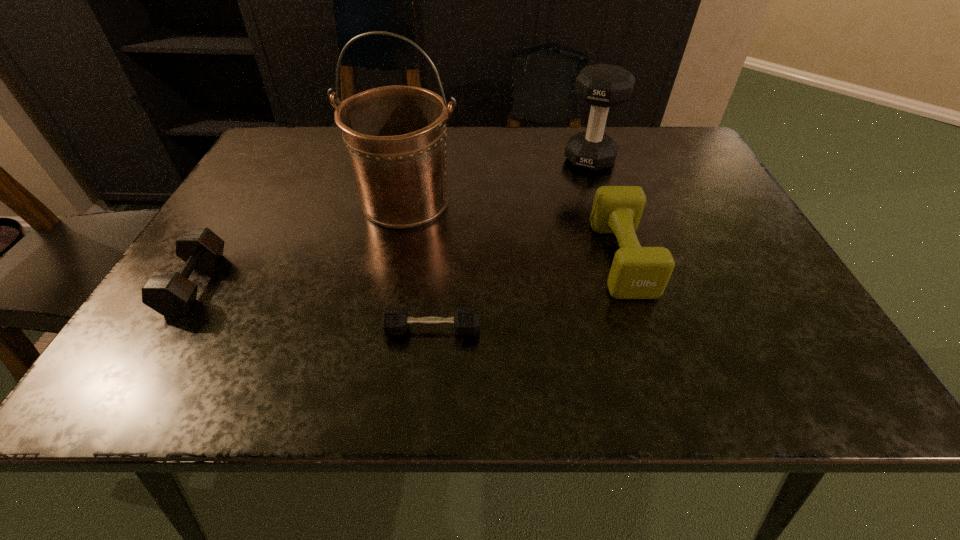
What are the coordinates of `free space located 0.210m on the back of the third tallest object` in the screenshot? It's located at pos(593,170).

The width and height of the screenshot is (960, 540). Identify the location of free space located 0.130m on the back of the leftmost dumbbell. (237, 215).

I want to click on vacant point located 0.260m on the left of the shortest object, so click(x=235, y=329).

The image size is (960, 540). I want to click on object at the far edge, so click(x=602, y=86).

At what (x,y) coordinates should I click in order to perform the action: click on object that is at the left edge. Please return your answer as a coordinate pair (x, y). This screenshot has width=960, height=540. Looking at the image, I should click on (169, 293).

Locate an element on the screen. The height and width of the screenshot is (540, 960). vacant space at the far edge of the desktop is located at coordinates pos(462,129).

Locate an element on the screen. This screenshot has height=540, width=960. free space at the near edge of the desktop is located at coordinates (596, 350).

I want to click on free spot at the left edge of the desktop, so click(283, 236).

Find the location of a particular element. The width and height of the screenshot is (960, 540). free location at the right edge is located at coordinates (767, 322).

The image size is (960, 540). I want to click on vacant area at the far right corner of the desktop, so click(x=671, y=126).